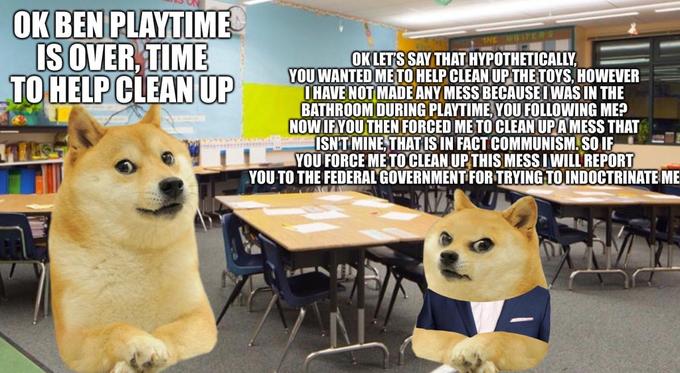
Identify the location of blue wall. The image size is (680, 373). (273, 45).